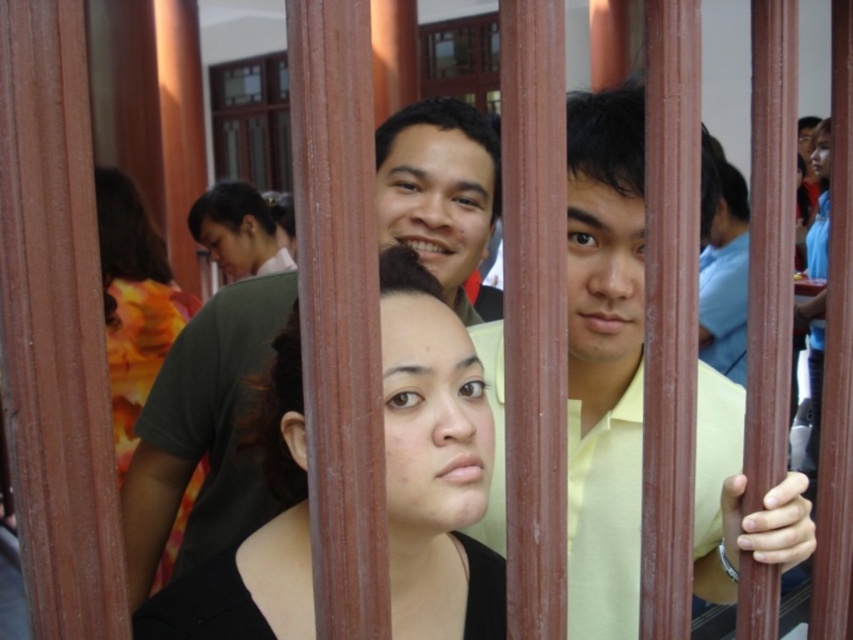
Question: Can you confirm if black matte hair at center is smaller than yellow-orange floral shirt at center-left?

Choices:
 (A) no
 (B) yes

Answer: (B)

Question: Can you confirm if black matte hair at center is positioned below dark brown hair at center?

Choices:
 (A) yes
 (B) no

Answer: (A)

Question: Can you confirm if black matte hair at center is positioned below yellow-orange floral shirt at center-left?

Choices:
 (A) no
 (B) yes

Answer: (B)

Question: Which object is closer to the camera taking this photo?

Choices:
 (A) black matte hair at center
 (B) yellow smooth shirt at center
 (C) dark brown hair at center

Answer: (A)

Question: Which point is closer to the camera?

Choices:
 (A) yellow smooth shirt at center
 (B) dark brown hair at center

Answer: (A)

Question: Which of these objects is positioned closest to the black matte hair at center?

Choices:
 (A) yellow-orange floral shirt at center-left
 (B) yellow smooth shirt at center

Answer: (B)